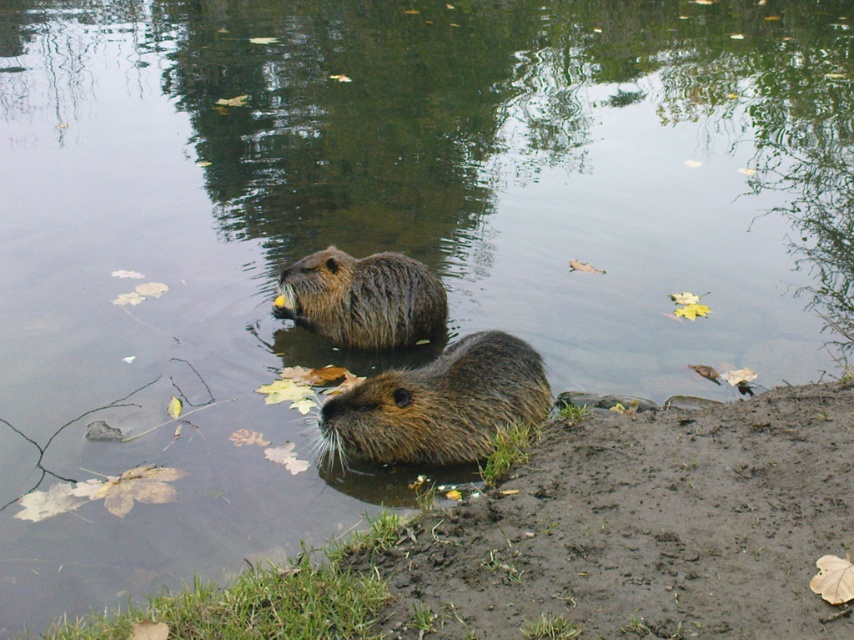
Can you confirm if brown fluffy mud at lower center is positioned above fuzzy brown otter at lower center?

Actually, brown fluffy mud at lower center is below fuzzy brown otter at lower center.

Who is higher up, brown fluffy mud at lower center or fuzzy brown otter at lower center?

Positioned higher is fuzzy brown otter at lower center.

Describe the element at coordinates (642, 529) in the screenshot. The image size is (854, 640). I see `brown fluffy mud at lower center` at that location.

At what (x,y) coordinates should I click in order to perform the action: click on brown fluffy mud at lower center. Please return your answer as a coordinate pair (x, y). Image resolution: width=854 pixels, height=640 pixels. Looking at the image, I should click on (642, 529).

Is point (325, 435) closer to viewer compared to point (338, 292)?

That is True.

Identify the location of fuzzy brown otter at lower center. This screenshot has height=640, width=854. (439, 404).

Who is more distant from viewer, (422, 406) or (398, 262)?

The point (398, 262) is behind.

You are a GUI agent. You are given a task and a screenshot of the screen. Output one action in this format:
    pyautogui.click(x=<x>, y=<y>)
    Task: Click on the fuzzy brown otter at lower center
    
    Given the screenshot: What is the action you would take?
    pyautogui.click(x=439, y=404)

From the picture: Who is positioned more to the right, brown fluffy mud at lower center or brown fuzzy otter at center?

brown fluffy mud at lower center is more to the right.

Does brown fluffy mud at lower center have a larger size compared to brown fuzzy otter at center?

Yes, brown fluffy mud at lower center is bigger than brown fuzzy otter at center.

What do you see at coordinates (642, 529) in the screenshot? This screenshot has height=640, width=854. I see `brown fluffy mud at lower center` at bounding box center [642, 529].

The height and width of the screenshot is (640, 854). I want to click on brown fluffy mud at lower center, so click(642, 529).